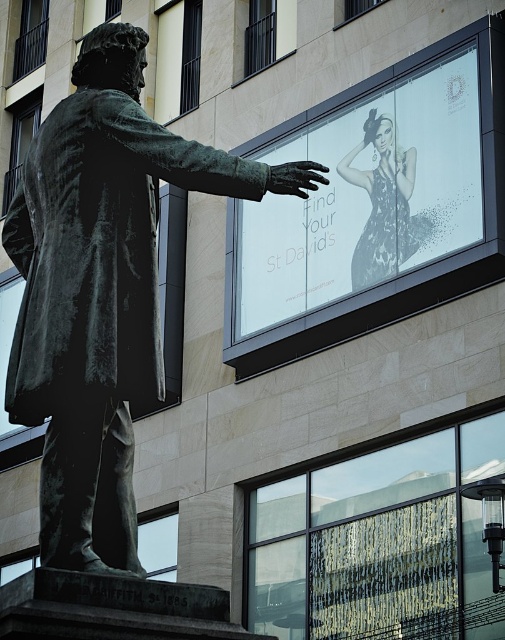
Question: Which of the following is the closest to the observer?

Choices:
 (A) white glossy poster at upper center
 (B) bronze statue at center

Answer: (B)

Question: Which point appears closest to the camera in this image?

Choices:
 (A) (382, 227)
 (B) (252, 177)

Answer: (B)

Question: Can you confirm if white glossy poster at upper center is bigger than shiny silver dress at upper center?

Choices:
 (A) yes
 (B) no

Answer: (A)

Question: Does white glossy poster at upper center appear over shiny silver dress at upper center?

Choices:
 (A) no
 (B) yes

Answer: (B)

Question: Does bronze statue at center have a smaller size compared to white glossy poster at upper center?

Choices:
 (A) yes
 (B) no

Answer: (A)

Question: Which point is closer to the camera?

Choices:
 (A) shiny silver dress at upper center
 (B) bronze statue at center

Answer: (B)